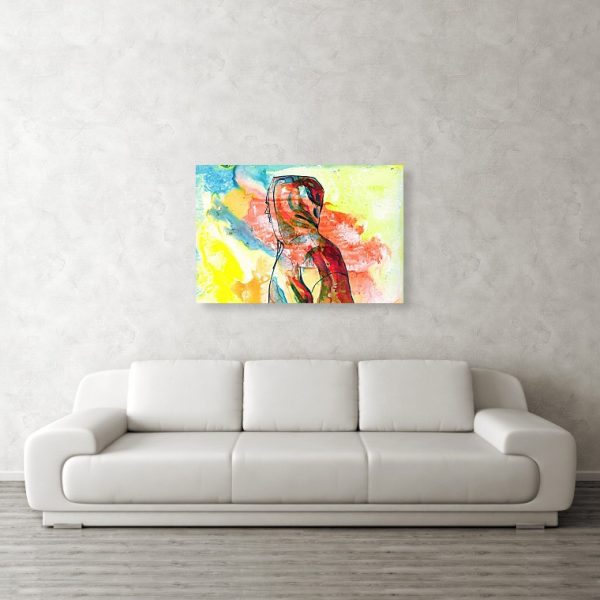
You are a GUI agent. You are given a task and a screenshot of the screen. Output one action in this format:
    pyautogui.click(x=<x>, y=<y>)
    Task: Click on the arm rest
    The width and height of the screenshot is (600, 600).
    Given the screenshot: What is the action you would take?
    pyautogui.click(x=524, y=422)